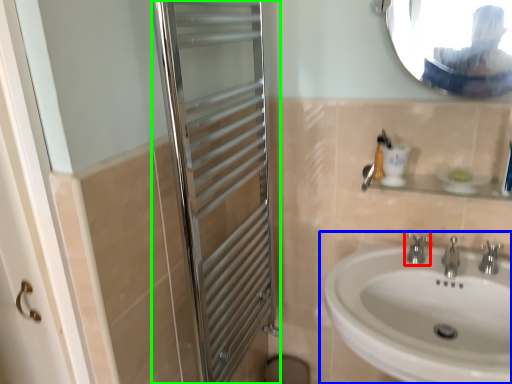
Question: Based on their relative distances, which object is farther from tap (highlighted by a red box)? Choose from sink (highlighted by a blue box) and screen door (highlighted by a green box).

Choices:
 (A) sink
 (B) screen door

Answer: (B)